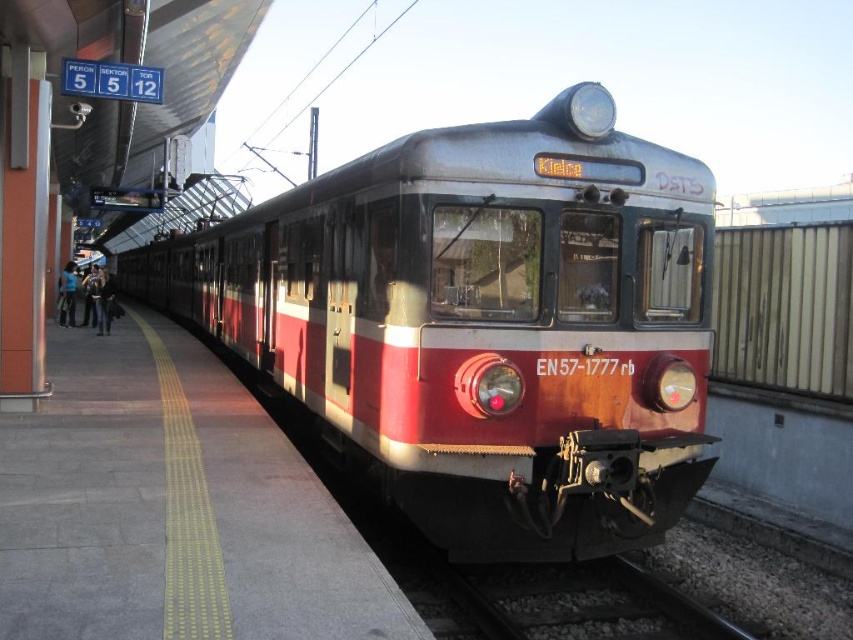
Question: Is red matte train at center above black metal train track at lower center?

Choices:
 (A) no
 (B) yes

Answer: (B)

Question: Can you confirm if red matte train at center is thinner than black metal train track at lower center?

Choices:
 (A) yes
 (B) no

Answer: (B)

Question: Which point is closer to the camera taking this photo?

Choices:
 (A) (509, 570)
 (B) (460, 211)

Answer: (B)

Question: Does red matte train at center lie in front of black metal train track at lower center?

Choices:
 (A) yes
 (B) no

Answer: (B)

Question: Which point appears closest to the camera in this image?

Choices:
 (A) (567, 122)
 (B) (625, 625)

Answer: (A)